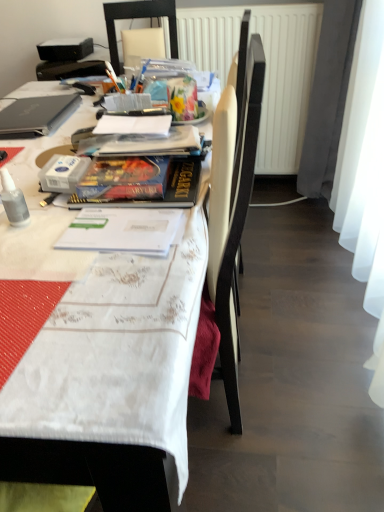
Question: From a real-world perspective, is hardcover book at center positioned above or below matte black laptop at upper left?

Choices:
 (A) below
 (B) above

Answer: (B)

Question: From the image's perspective, is hardcover book at center positioned above or below matte black laptop at upper left?

Choices:
 (A) above
 (B) below

Answer: (B)

Question: Estimate the real-world distances between objects in this image. Which object is farther from the white textured radiator at upper center?

Choices:
 (A) transparent plastic bottle at left
 (B) white plastic chair at upper center
 (C) white fabric table at upper left
 (D) hardcover book at center
 (E) matte black laptop at upper left

Answer: (A)

Question: Which object is positioned closest to the white textured radiator at upper center?

Choices:
 (A) matte black laptop at upper left
 (B) transparent plastic bottle at left
 (C) hardcover book at center
 (D) white plastic chair at upper center
 (E) white fabric table at upper left

Answer: (D)